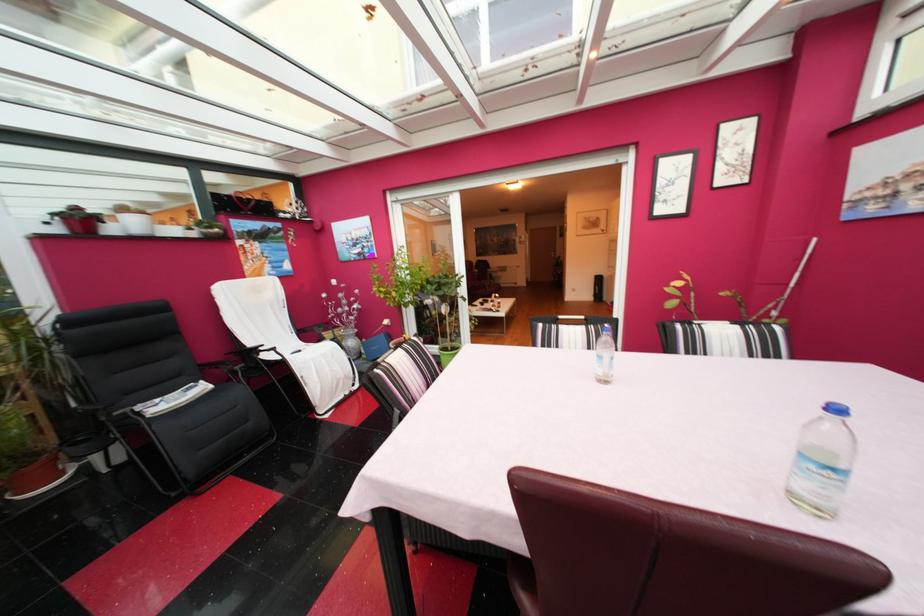
You are a GUI agent. You are given a task and a screenshot of the screen. Output one action in this format:
    pyautogui.click(x=<x>, y=<y>)
    Task: Click on the black chair armrest
    Image resolution: width=924 pixels, height=616 pixels.
    Given the screenshot: What is the action you would take?
    pyautogui.click(x=99, y=460)